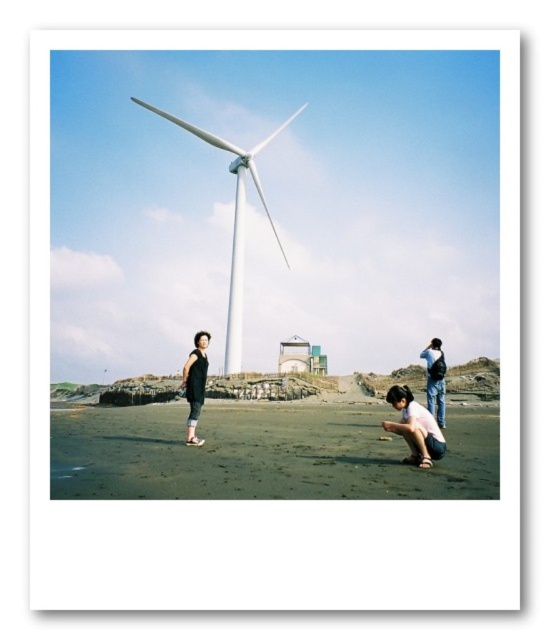
Does light pink fabric at lower center have a greater width compared to dark gray fabric dress at lower center?

No.

Find the location of a particular element. The height and width of the screenshot is (640, 550). light pink fabric at lower center is located at coordinates (415, 428).

From the picture: Does dark sand at lower center have a smaller size compared to dark gray fabric dress at lower center?

No, dark sand at lower center is not smaller than dark gray fabric dress at lower center.

Locate an element on the screen. dark sand at lower center is located at coordinates (264, 452).

Between point (209, 493) and point (195, 413), which one is positioned in front?

Point (209, 493) is more forward.

Where is `dark sand at lower center`? This screenshot has height=640, width=550. dark sand at lower center is located at coordinates (264, 452).

Does white matte wind turbine at center have a lesser width compared to matte black backpack at lower right?

Incorrect, white matte wind turbine at center's width is not less than matte black backpack at lower right's.

Which is behind, point (244, 205) or point (437, 369)?

The point (244, 205) is behind.

Image resolution: width=550 pixels, height=640 pixels. I want to click on white matte wind turbine at center, so [x=234, y=221].